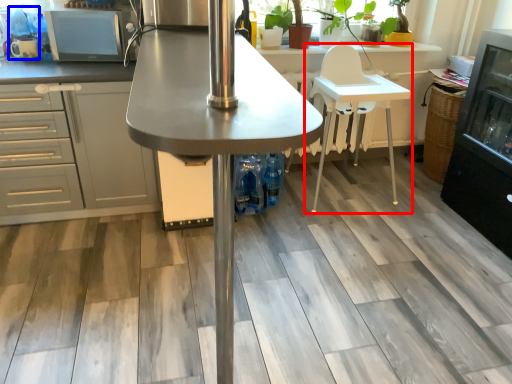
Question: Which point is further to the camera, chair (highlighted by a red box) or appliance (highlighted by a blue box)?

Choices:
 (A) chair
 (B) appliance

Answer: (B)